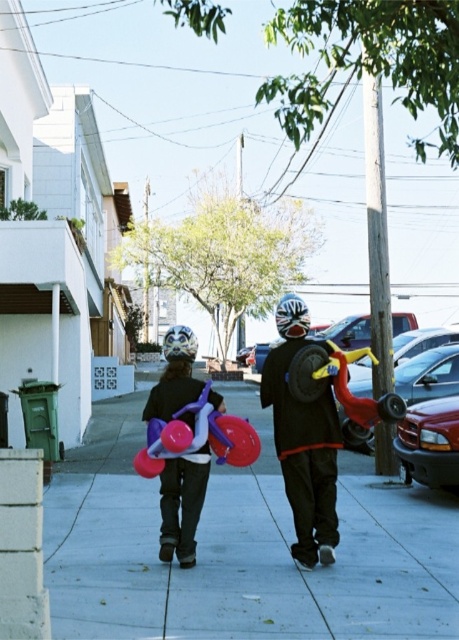
Does white matte helmet at center come behind shiny metallic helmet at center?

No, white matte helmet at center is closer to the viewer.

Which is in front, point (279, 310) or point (195, 353)?

Point (279, 310) is in front.

Find the location of `white matte helmet at center`. white matte helmet at center is located at coordinates (291, 316).

Is rubberized yellow and red scooter at center shorter than white matte helmet at center?

No, rubberized yellow and red scooter at center is not shorter than white matte helmet at center.

Is point (373, 364) farther from camera compared to point (283, 310)?

Yes, it is behind point (283, 310).

Locate an element on the screen. This screenshot has height=640, width=459. rubberized yellow and red scooter at center is located at coordinates (339, 384).

Is matte purple balloon at center smaller than rubberized yellow and red scooter at center?

No.

Does point (166, 339) come farther from viewer compared to point (365, 424)?

That is True.

Locate an element on the screen. The height and width of the screenshot is (640, 459). matte purple balloon at center is located at coordinates (182, 504).